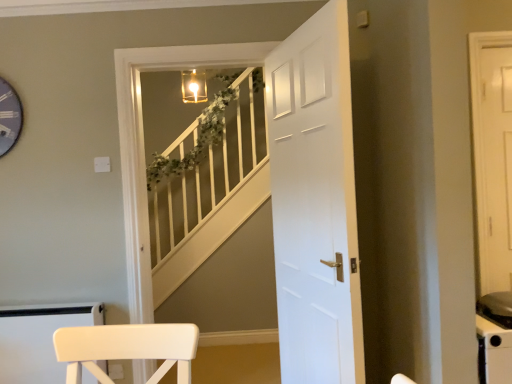
Locate an element on the screen. The image size is (512, 384). white wooden staircase at center is located at coordinates (209, 185).

What do you see at coordinates (209, 185) in the screenshot?
I see `white wooden staircase at center` at bounding box center [209, 185].

Locate an element on the screen. white matte door at center is located at coordinates (315, 202).

The height and width of the screenshot is (384, 512). What do you see at coordinates (315, 202) in the screenshot?
I see `white matte door at center` at bounding box center [315, 202].

I want to click on white wooden staircase at center, so click(209, 185).

Does white matte door at center appear on the left side of white wooden staircase at center?

No, white matte door at center is not to the left of white wooden staircase at center.

Is white matte door at center behind white wooden staircase at center?

No, white matte door at center is closer to the camera.

Which point is more forward, (350, 330) or (234, 158)?

The point (350, 330) is closer to the camera.

From the image's perspective, is white matte door at center positioned above or below white wooden staircase at center?

Based on their image positions, white matte door at center is located above white wooden staircase at center.

From a real-world perspective, is white matte door at center located beneath white wooden staircase at center?

No, from a real-world perspective, white matte door at center is not beneath white wooden staircase at center.

Which of these two, white matte door at center or white wooden staircase at center, is wider?

Wider between the two is white wooden staircase at center.

Considering the relative sizes of white matte door at center and white wooden staircase at center in the image provided, is white matte door at center taller than white wooden staircase at center?

Yes.

Considering the sizes of white matte door at center and white wooden staircase at center in the image, is white matte door at center bigger or smaller than white wooden staircase at center?

In the image, white matte door at center appears to be larger than white wooden staircase at center.

Is white matte door at center positioned beyond the bounds of white wooden staircase at center?

That's correct, white matte door at center is outside of white wooden staircase at center.

Is there a large distance between white matte door at center and white wooden staircase at center?

Absolutely, white matte door at center is distant from white wooden staircase at center.

Is white matte door at center aimed at white wooden staircase at center?

No, white matte door at center does not turn towards white wooden staircase at center.

In the scene shown: How many degrees apart are the facing directions of white matte door at center and white wooden staircase at center?

The angular difference between white matte door at center and white wooden staircase at center is 74.1 degrees.

How far apart are white matte door at center and white wooden staircase at center?

1.57 meters.

The height and width of the screenshot is (384, 512). Find the location of `stairwell on the left of the white matte door at center`. stairwell on the left of the white matte door at center is located at coordinates (209, 185).

Considering the positions of objects white wooden staircase at center and white matte door at center in the image provided, who is more to the left, white wooden staircase at center or white matte door at center?

white wooden staircase at center is more to the left.

Is white wooden staircase at center further to camera compared to white matte door at center?

Yes, it is.

Which is further, (198, 204) or (280, 357)?

The point (198, 204) is more distant.

From the image's perspective, does white wooden staircase at center appear lower than white matte door at center?

Correct, white wooden staircase at center appears lower than white matte door at center in the image.

From a real-world perspective, is white wooden staircase at center on white matte door at center?

No, from a real-world perspective, white wooden staircase at center is not over white matte door at center

Looking at their sizes, would you say white wooden staircase at center is wider or thinner than white matte door at center?

Considering their sizes, white wooden staircase at center looks broader than white matte door at center.

Can you confirm if white wooden staircase at center is taller than white matte door at center?

No.

Considering the sizes of objects white wooden staircase at center and white matte door at center in the image provided, who is smaller, white wooden staircase at center or white matte door at center?

Smaller between the two is white wooden staircase at center.

Can we say white wooden staircase at center lies outside white matte door at center?

Absolutely, white wooden staircase at center is external to white matte door at center.

Is white wooden staircase at center not near white matte door at center?

That's right, there is a large distance between white wooden staircase at center and white matte door at center.

Is white wooden staircase at center looking in the opposite direction of white matte door at center?

No, white wooden staircase at center is not facing the opposite direction of white matte door at center.

Can you tell me how much white wooden staircase at center and white matte door at center differ in facing direction?

The angle between the facing direction of white wooden staircase at center and the facing direction of white matte door at center is 74.1 degrees.

Locate an element on the screen. Image resolution: width=512 pixels, height=384 pixels. door above the white wooden staircase at center (from the image's perspective) is located at coordinates (315, 202).

At what (x,y) coordinates should I click in order to perform the action: click on door in front of the white wooden staircase at center. Please return your answer as a coordinate pair (x, y). The image size is (512, 384). Looking at the image, I should click on (315, 202).

At what (x,y) coordinates should I click in order to perform the action: click on stairwell behind the white matte door at center. Please return your answer as a coordinate pair (x, y). The image size is (512, 384). Looking at the image, I should click on (209, 185).